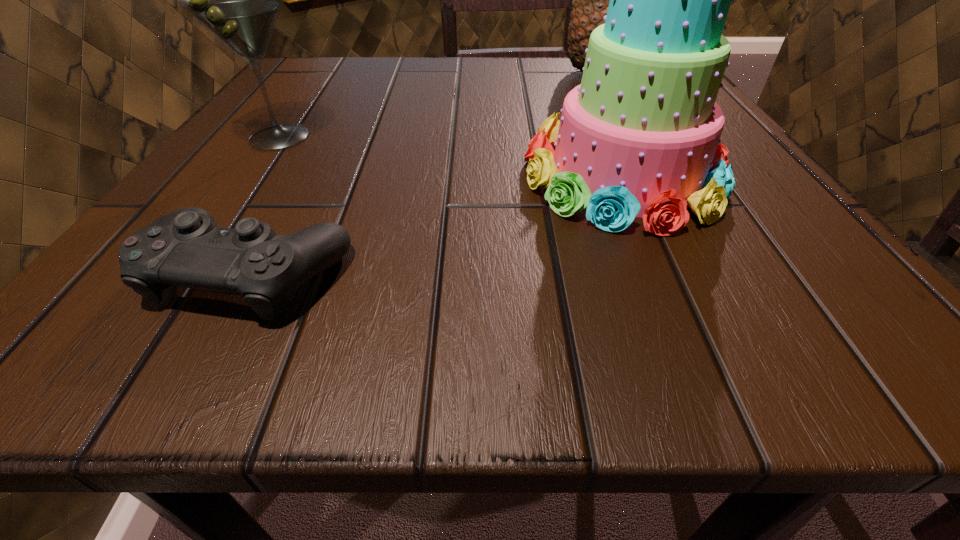
Locate an element on the screen. Image resolution: width=960 pixels, height=540 pixels. vacant space at the right edge is located at coordinates (809, 281).

I want to click on free spot between the martini and the control, so click(265, 205).

This screenshot has height=540, width=960. I want to click on free space that is in between the martini and the cake, so click(x=450, y=156).

Identify the location of vacant space that is in between the cake and the martini. (450, 156).

At what (x,y) coordinates should I click in order to perform the action: click on vacant area that lies between the martini and the farthest object. Please return your answer as a coordinate pair (x, y). Looking at the image, I should click on (436, 105).

In order to click on unoccupied position between the cake and the control in this screenshot , I will do `click(437, 224)`.

Find the location of a particular element. The height and width of the screenshot is (540, 960). vacant space that is in between the martini and the farthest object is located at coordinates (436, 105).

Identify the location of free space between the martini and the cake. This screenshot has width=960, height=540. tap(450, 156).

In order to click on vacant area that lies between the tallest object and the martini in this screenshot , I will do `click(436, 105)`.

This screenshot has height=540, width=960. I want to click on unoccupied position between the martini and the cake, so click(450, 156).